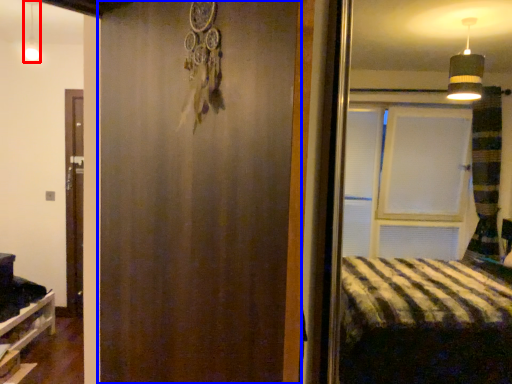
Question: Among these objects, which one is nearest to the camera, light fixture (highlighted by a red box) or barn door (highlighted by a blue box)?

Choices:
 (A) light fixture
 (B) barn door

Answer: (B)